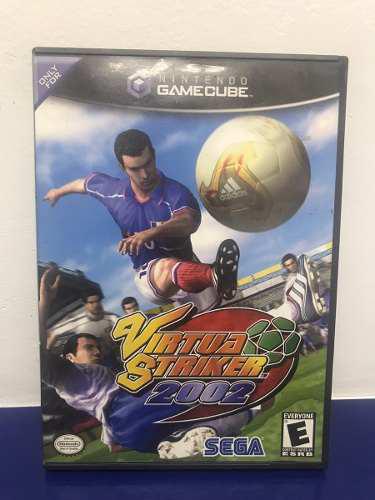
Locate an element on the screen. stands is located at coordinates (266, 286).